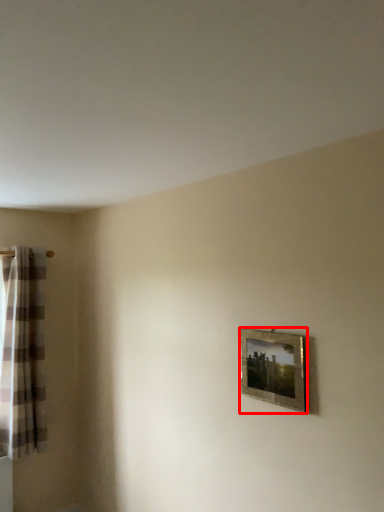
Question: Observing the image, what is the correct spatial positioning of picture frame (annotated by the red box) in reference to curtain?

Choices:
 (A) left
 (B) right

Answer: (B)